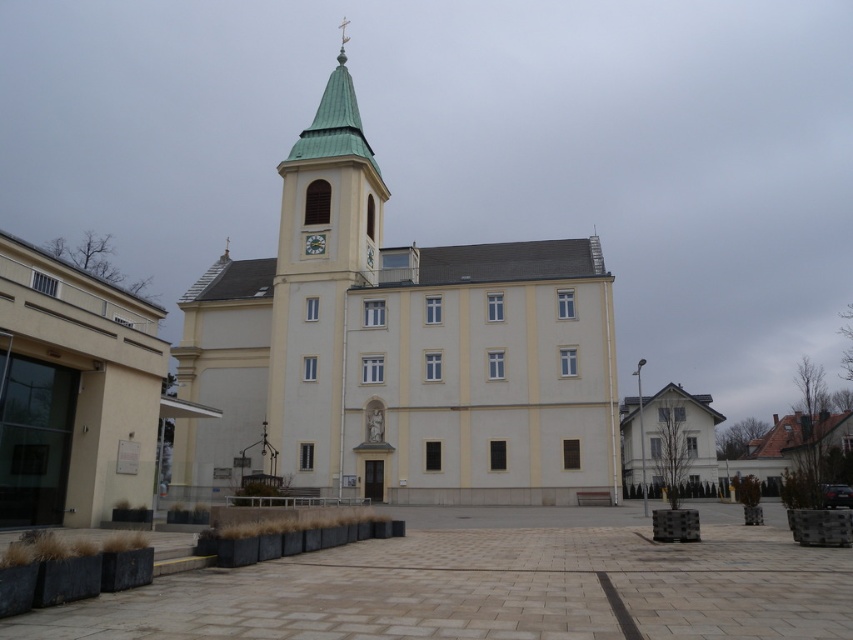
Which is behind, point (454, 385) or point (296, 157)?

Point (296, 157)

What do you see at coordinates (397, 349) in the screenshot? This screenshot has height=640, width=853. I see `beige stucco church at center` at bounding box center [397, 349].

This screenshot has height=640, width=853. I want to click on beige stucco church at center, so click(x=397, y=349).

Between green matte tower at center and white glossy clock at center, which one has more height?

green matte tower at center

Does green matte tower at center have a lesser height compared to white glossy clock at center?

No, green matte tower at center is not shorter than white glossy clock at center.

The height and width of the screenshot is (640, 853). What do you see at coordinates (321, 276) in the screenshot?
I see `green matte tower at center` at bounding box center [321, 276].

The image size is (853, 640). In order to click on green matte tower at center in this screenshot , I will do click(321, 276).

Which is in front, point (517, 481) or point (308, 244)?

Point (517, 481)

Does point (520, 406) come behind point (315, 236)?

No, (520, 406) is closer to viewer.

This screenshot has height=640, width=853. In order to click on beige stucco church at center in this screenshot , I will do `click(397, 349)`.

This screenshot has height=640, width=853. Find the location of `beige stucco church at center`. beige stucco church at center is located at coordinates (397, 349).